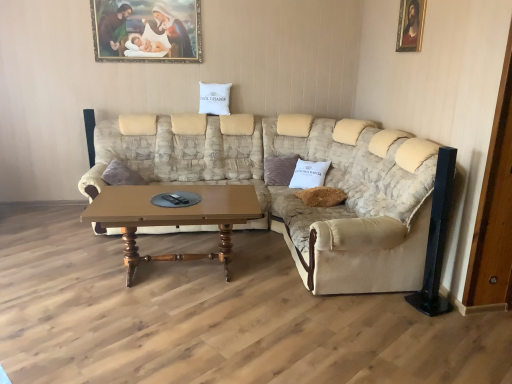
Question: Is the depth of wooden framed portrait at upper right, positioned as the 2th picture frame in back-to-front order, less than that of wooden framed painting at upper center, marked as the second picture frame in a right-to-left arrangement?

Choices:
 (A) yes
 (B) no

Answer: (A)

Question: Is wooden framed portrait at upper right, which ranks as the 2th picture frame in left-to-right order, thinner than wooden framed painting at upper center, which is the 1th picture frame from back to front?

Choices:
 (A) yes
 (B) no

Answer: (B)

Question: Is wooden framed portrait at upper right, which ranks as the 2th picture frame in left-to-right order, to the left of wooden framed painting at upper center, which is counted as the first picture frame, starting from the left, from the viewer's perspective?

Choices:
 (A) yes
 (B) no

Answer: (B)

Question: Can we say wooden framed portrait at upper right, acting as the first picture frame starting from the front, lies outside wooden framed painting at upper center, placed as the 2th picture frame when sorted from front to back?

Choices:
 (A) yes
 (B) no

Answer: (A)

Question: Considering the relative sizes of wooden framed portrait at upper right, acting as the first picture frame starting from the front, and wooden framed painting at upper center, placed as the 2th picture frame when sorted from front to back, in the image provided, is wooden framed portrait at upper right, acting as the first picture frame starting from the front, wider than wooden framed painting at upper center, placed as the 2th picture frame when sorted from front to back,?

Choices:
 (A) yes
 (B) no

Answer: (A)

Question: Does wooden framed portrait at upper right, which ranks as the 2th picture frame in left-to-right order, appear on the right side of wooden framed painting at upper center, which is the 1th picture frame from back to front?

Choices:
 (A) no
 (B) yes

Answer: (B)

Question: Is white fabric pillow at upper center, the first pillow positioned from the left, to the left of wooden framed portrait at upper right, the first picture frame positioned from the right, from the viewer's perspective?

Choices:
 (A) yes
 (B) no

Answer: (A)

Question: Considering the relative sizes of white fabric pillow at upper center, which is the first pillow in top-to-bottom order, and wooden framed portrait at upper right, the first picture frame positioned from the right, in the image provided, is white fabric pillow at upper center, which is the first pillow in top-to-bottom order, shorter than wooden framed portrait at upper right, the first picture frame positioned from the right,?

Choices:
 (A) no
 (B) yes

Answer: (B)

Question: Is white fabric pillow at upper center, the second pillow from the bottom, taller than wooden framed portrait at upper right, positioned as the 2th picture frame in back-to-front order?

Choices:
 (A) no
 (B) yes

Answer: (A)

Question: Can you confirm if white fabric pillow at upper center, which is the first pillow in top-to-bottom order, is smaller than wooden framed portrait at upper right, acting as the first picture frame starting from the front?

Choices:
 (A) yes
 (B) no

Answer: (B)

Question: Is white fabric pillow at upper center, the first pillow positioned from the left, at the right side of wooden framed portrait at upper right, the first picture frame positioned from the right?

Choices:
 (A) yes
 (B) no

Answer: (B)

Question: From the image's perspective, is white fabric pillow at upper center, which is the first pillow in top-to-bottom order, above wooden framed portrait at upper right, the first picture frame positioned from the right?

Choices:
 (A) no
 (B) yes

Answer: (A)

Question: From the image's perspective, is beige fabric couch at right on top of wooden framed portrait at upper right, positioned as the 2th picture frame in back-to-front order?

Choices:
 (A) yes
 (B) no

Answer: (B)